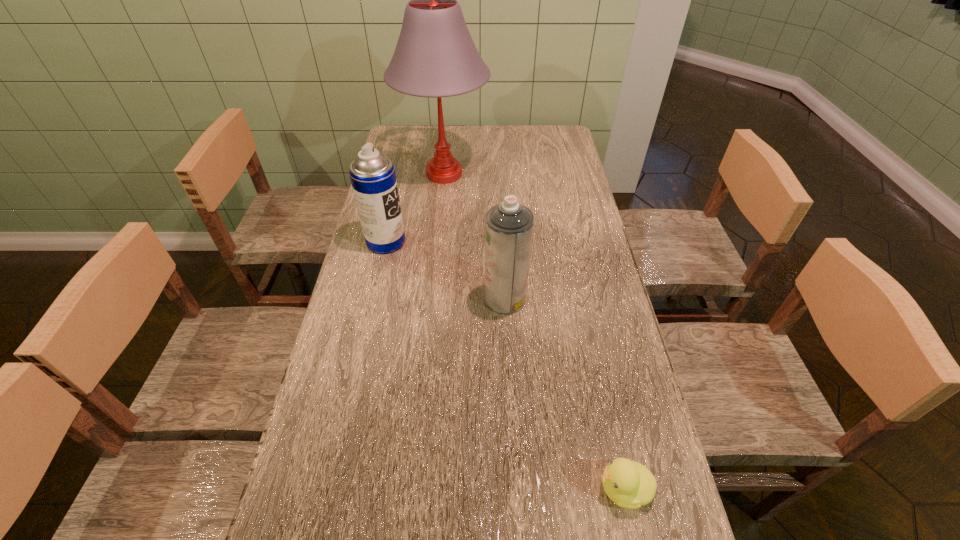
The width and height of the screenshot is (960, 540). Find the location of `vacant space at the left edge of the desktop`. vacant space at the left edge of the desktop is located at coordinates (412, 190).

Locate an element on the screen. free space at the right edge of the desktop is located at coordinates (588, 243).

Identify the location of free area in between the second farthest object and the table lamp. This screenshot has width=960, height=540. (415, 207).

Image resolution: width=960 pixels, height=540 pixels. Identify the location of free spot between the table lamp and the third farthest object. (474, 236).

This screenshot has width=960, height=540. I want to click on vacant area between the left aerosol can and the duckling, so click(x=505, y=365).

Identify the location of vacant space that is in between the right aerosol can and the table lamp. The width and height of the screenshot is (960, 540). (474, 236).

Locate an element on the screen. This screenshot has width=960, height=540. vacant point located between the right aerosol can and the tallest object is located at coordinates (474, 236).

Find the location of a particular element. Image resolution: width=960 pixels, height=540 pixels. vacant area that lies between the table lamp and the right aerosol can is located at coordinates (474, 236).

Where is `free space between the shortest object and the right aerosol can`? free space between the shortest object and the right aerosol can is located at coordinates (564, 393).

Identify the location of free space that is in between the right aerosol can and the tallest object. (474, 236).